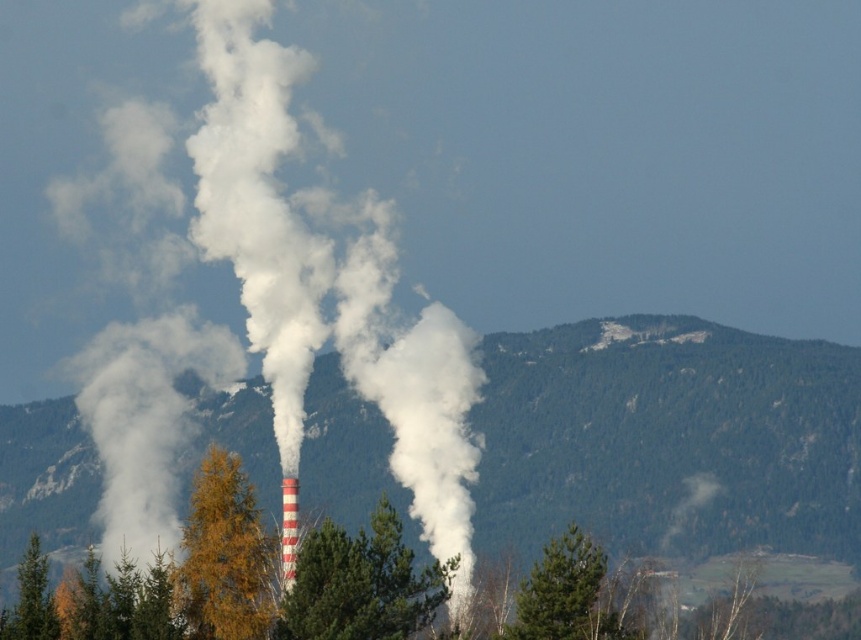
Can you confirm if green textured tree at center is bigger than green matte tree at lower left?

Incorrect, green textured tree at center is not larger than green matte tree at lower left.

Is green textured tree at center behind green matte tree at lower left?

That is False.

Measure the distance between green textured tree at center and camera.

384.81 meters

Where is `green textured tree at center`? This screenshot has width=861, height=640. green textured tree at center is located at coordinates (360, 582).

Does white smoke at center appear under green textured tree at center?

No.

Is point (290, 344) in front of point (327, 579)?

No.

Locate an element on the screen. The image size is (861, 640). white smoke at center is located at coordinates (326, 282).

Can you confirm if green forested mountain at center is positioned to the right of yellow leafy tree at center?

Yes, green forested mountain at center is to the right of yellow leafy tree at center.

Is point (208, 412) positioned after point (238, 600)?

Yes, point (208, 412) is farther from viewer.

You are a GUI agent. You are given a task and a screenshot of the screen. Output one action in this format:
    pyautogui.click(x=<x>, y=<y>)
    Task: Click on the green forested mountain at center
    
    Given the screenshot: What is the action you would take?
    pyautogui.click(x=669, y=440)